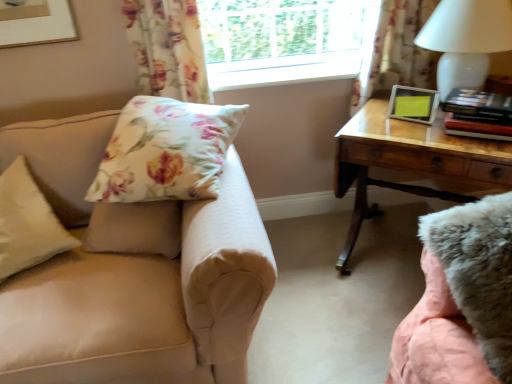
Find the location of a particular element. This screenshot has width=512, height=384. vacant area to the left of yellow matte picture frame at upper right is located at coordinates (378, 124).